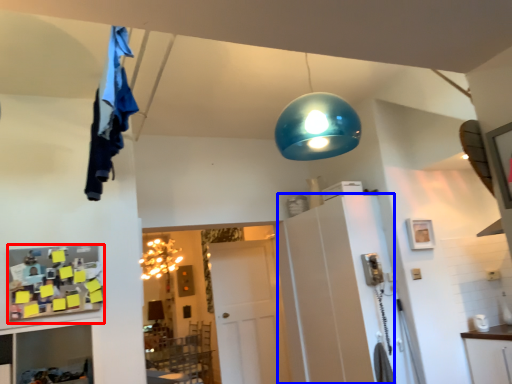
Question: Which point is closer to the camera, shelf (highlighted by a red box) or cabinetry (highlighted by a blue box)?

Choices:
 (A) shelf
 (B) cabinetry

Answer: (A)